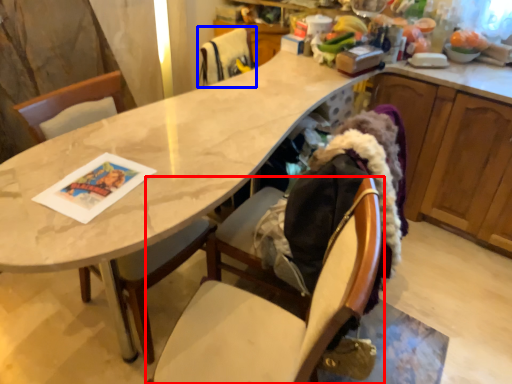
Question: Which point is further to the camera, chair (highlighted by a red box) or chair (highlighted by a blue box)?

Choices:
 (A) chair
 (B) chair

Answer: (B)